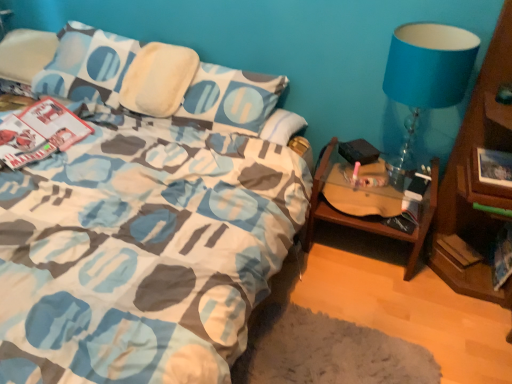
Find the location of a particular element. This screenshot has width=512, height=384. free location to the left of hardcover book at lower right is located at coordinates (410, 258).